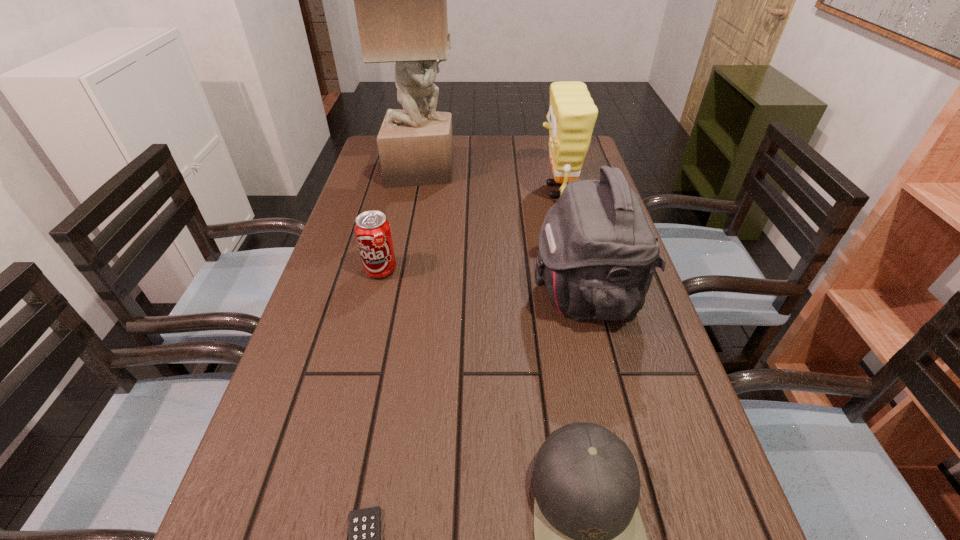
This screenshot has height=540, width=960. I want to click on free space located on the open flap of the shoulder bag, so click(434, 293).

Find the location of a particular element. The image size is (960, 540). free spot located on the front of the fourth tallest object is located at coordinates (353, 382).

Where is `object present at the far edge`? object present at the far edge is located at coordinates (400, 0).

This screenshot has width=960, height=540. Identify the location of sculpture that is at the left edge. (400, 0).

The width and height of the screenshot is (960, 540). I want to click on soda situated at the left edge, so (x=373, y=233).

What are the coordinates of `sponge located at the right edge` in the screenshot? It's located at (572, 114).

Locate an element on the screen. shoulder bag that is at the right edge is located at coordinates (597, 253).

This screenshot has width=960, height=540. I want to click on object that is positioned at the far left corner, so click(400, 0).

Locate an element on the screen. Image resolution: width=960 pixels, height=540 pixels. free space at the far edge of the desktop is located at coordinates (482, 140).

This screenshot has height=540, width=960. Find the location of `free space at the left edge`. free space at the left edge is located at coordinates (259, 511).